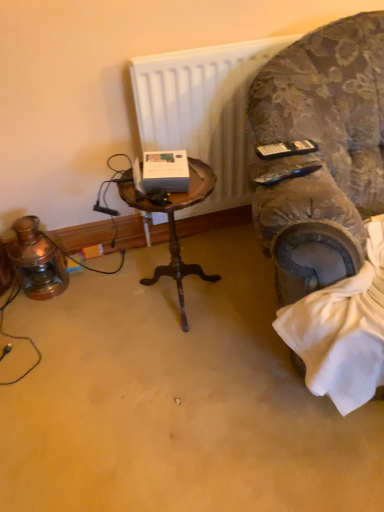
Where is `vacant area on top of white matte radiator at upper center (from a real-world perspective)`? vacant area on top of white matte radiator at upper center (from a real-world perspective) is located at coordinates (211, 50).